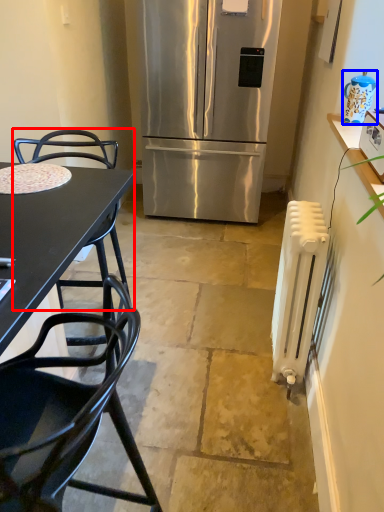
Question: Which object is closer to the camera taking this photo, chair (highlighted by a red box) or appliance (highlighted by a blue box)?

Choices:
 (A) chair
 (B) appliance

Answer: (A)